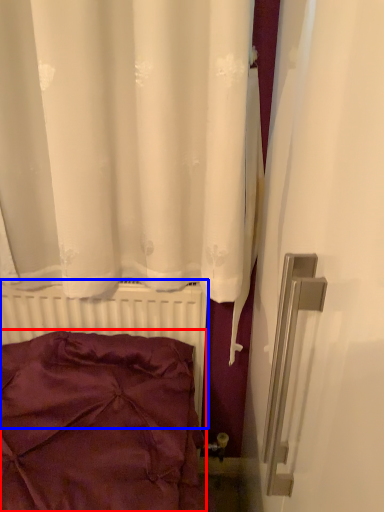
Question: Among these objects, which one is nearest to the camera, pillow (highlighted by a red box) or radiator (highlighted by a blue box)?

Choices:
 (A) pillow
 (B) radiator

Answer: (A)